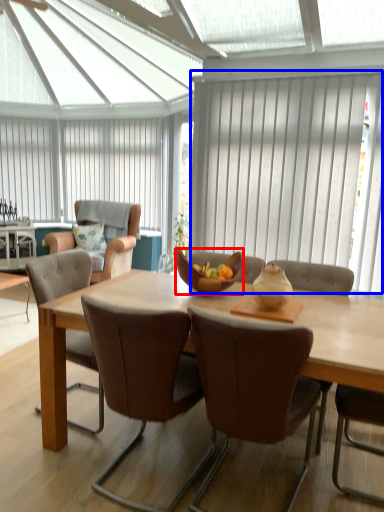
Question: Which object is closer to the camera taking this photo, bowl (highlighted by a red box) or curtain (highlighted by a blue box)?

Choices:
 (A) bowl
 (B) curtain

Answer: (A)